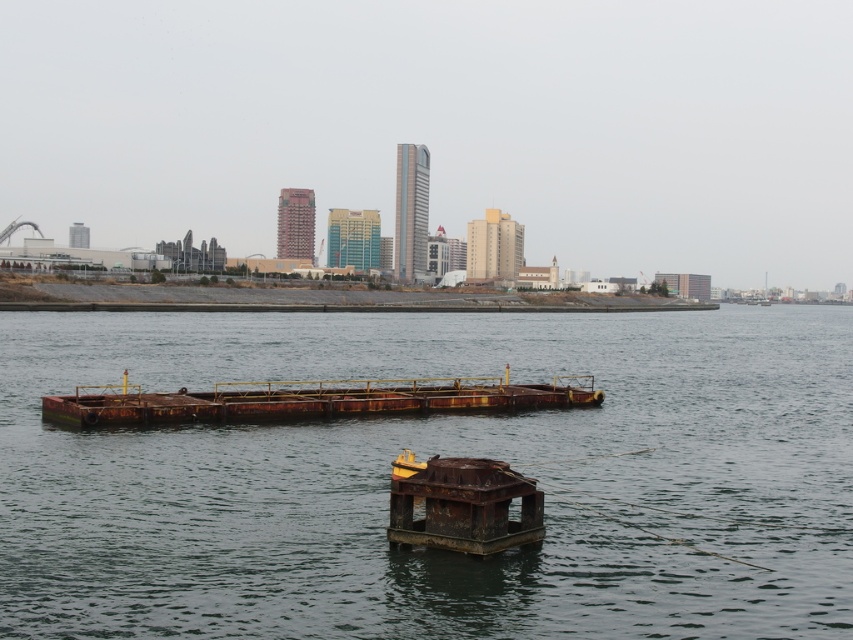
Is rusty metal water at center thinner than rusty metal barge at center?

No.

Is rusty metal water at center above rusty metal barge at center?

Yes, rusty metal water at center is above rusty metal barge at center.

At what (x,y) coordinates should I click in order to perform the action: click on rusty metal water at center. Please return your answer as a coordinate pair (x, y). Looking at the image, I should click on (426, 456).

Does rusty metal barge at center have a lesser width compared to rusty metal dock at center?

Incorrect, rusty metal barge at center's width is not less than rusty metal dock at center's.

Find the location of a particular element. The width and height of the screenshot is (853, 640). rusty metal barge at center is located at coordinates (312, 401).

Which is behind, point (303, 406) or point (505, 492)?

The point (303, 406) is behind.

The height and width of the screenshot is (640, 853). What are the coordinates of `rusty metal barge at center` in the screenshot? It's located at (312, 401).

Is rusty metal water at center thinner than rusty metal dock at center?

In fact, rusty metal water at center might be wider than rusty metal dock at center.

Who is higher up, rusty metal water at center or rusty metal dock at center?

Positioned higher is rusty metal water at center.

Find the location of `rusty metal water at center`. rusty metal water at center is located at coordinates (426, 456).